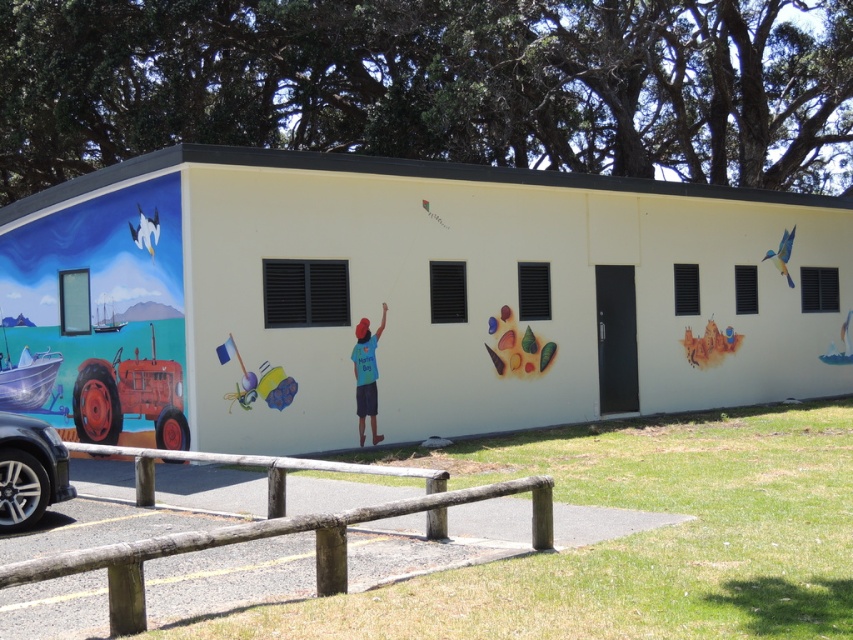
Question: Can you confirm if matte yellow building at center is positioned above wooden fence at lower center?

Choices:
 (A) yes
 (B) no

Answer: (A)

Question: Does matte yellow building at center have a smaller size compared to matte yellow castle at center right?

Choices:
 (A) no
 (B) yes

Answer: (A)

Question: Which object is farther from the camera taking this photo?

Choices:
 (A) matte yellow castle at center right
 (B) glossy acrylic leaves at center

Answer: (A)

Question: Can you confirm if matte yellow building at center is positioned above shiny silver car at lower left?

Choices:
 (A) yes
 (B) no

Answer: (A)

Question: Among these points, which one is nearest to the camera?

Choices:
 (A) (55, 260)
 (B) (763, 426)
 (C) (506, 360)

Answer: (B)

Question: Which point is closer to the camera taking this photo?

Choices:
 (A) (492, 330)
 (B) (62, 461)
 (C) (639, 596)
 (D) (282, 324)

Answer: (C)